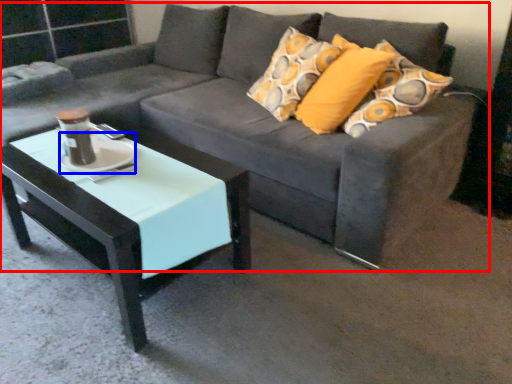
Question: Which object appears closest to the camera in this image, studio couch (highlighted by a red box) or saucer (highlighted by a blue box)?

Choices:
 (A) studio couch
 (B) saucer

Answer: (A)